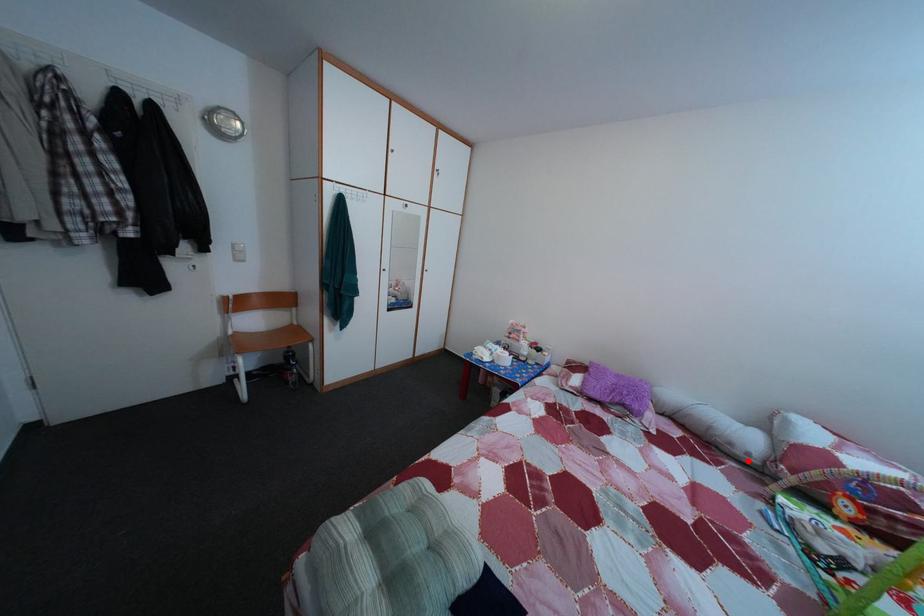
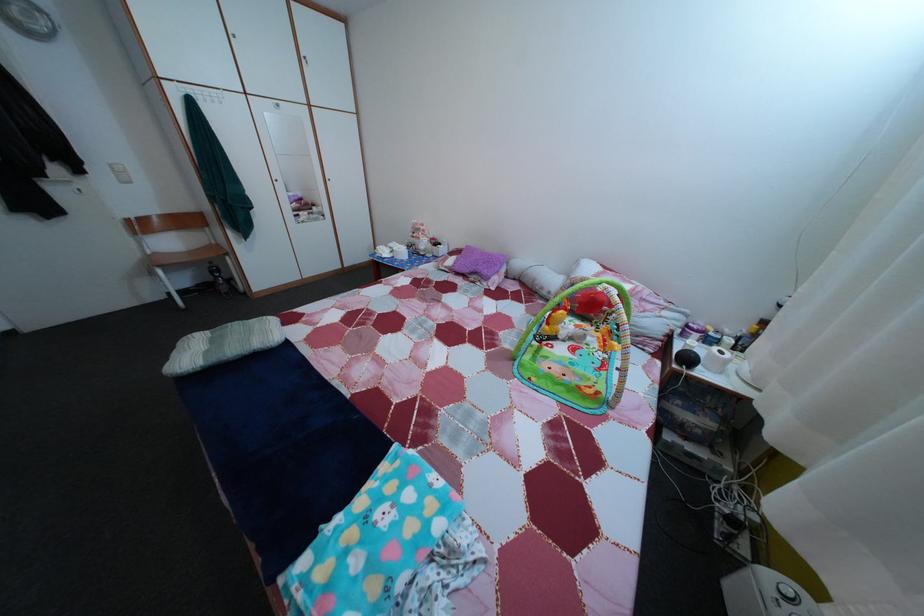
The point at the highlighted location is marked in the first image. Where is the corresponding point in the second image?

(553, 301)